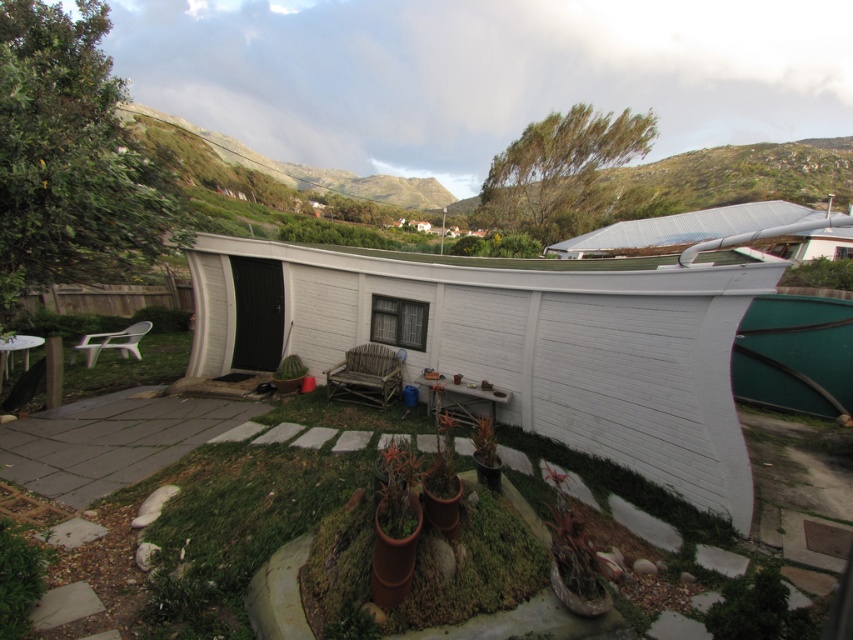
Question: Can you confirm if wooden bench at center is wider than white plastic chair at lower left?

Choices:
 (A) no
 (B) yes

Answer: (B)

Question: Which point is closer to the camera?

Choices:
 (A) (340, 397)
 (B) (126, 349)

Answer: (A)

Question: Does white wood hut at center have a smaller size compared to green grassy hillside at upper center?

Choices:
 (A) no
 (B) yes

Answer: (B)

Question: Which point is closer to the camera taking this photo?

Choices:
 (A) (601, 241)
 (B) (354, 381)
 (C) (733, 272)
 (D) (750, 163)

Answer: (C)

Question: Which point is closer to the camera taking this photo?

Choices:
 (A) (668, 179)
 (B) (704, 506)

Answer: (B)

Question: Can you confirm if white wood hut at center is wider than white plastic chair at lower left?

Choices:
 (A) no
 (B) yes

Answer: (B)